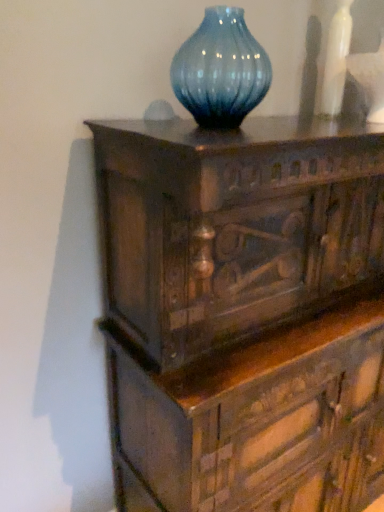
What do you see at coordinates (244, 310) in the screenshot? This screenshot has width=384, height=512. I see `dark wood chest of drawers at center` at bounding box center [244, 310].

What is the approximate width of dark wood chest of drawers at center?

The width of dark wood chest of drawers at center is 21.06 inches.

At what (x,y) coordinates should I click in order to perform the action: click on dark wood chest of drawers at center. Please return your answer as a coordinate pair (x, y). The width and height of the screenshot is (384, 512). Looking at the image, I should click on (244, 310).

In order to face dark wood chest of drawers at center, should I rotate leftwards or rightwards?

Rotate right and turn 16.116 degrees.

Image resolution: width=384 pixels, height=512 pixels. What do you see at coordinates (336, 59) in the screenshot? I see `white glossy vase at upper right` at bounding box center [336, 59].

Measure the distance between point (344, 31) and camera.

Point (344, 31) and camera are 3.94 feet apart from each other.

Locate an element on the screen. Image resolution: width=384 pixels, height=512 pixels. white glossy vase at upper right is located at coordinates (336, 59).

Identify the location of dark wood chest of drawers at center. The width and height of the screenshot is (384, 512). (244, 310).

Which object is positioned more to the right, white glossy vase at upper right or dark wood chest of drawers at center?

Positioned to the right is dark wood chest of drawers at center.

Which object is further away from the camera, white glossy vase at upper right or dark wood chest of drawers at center?

white glossy vase at upper right is further from the camera.

Is point (339, 91) more distant than point (223, 349)?

Yes.

From the image's perspective, is white glossy vase at upper right beneath dark wood chest of drawers at center?

No, from the image's perspective, white glossy vase at upper right is not beneath dark wood chest of drawers at center.

From a real-world perspective, is white glossy vase at upper right on dark wood chest of drawers at center?

Yes, from a real-world perspective, white glossy vase at upper right is over dark wood chest of drawers at center

Is white glossy vase at upper right thinner than dark wood chest of drawers at center?

Correct, the width of white glossy vase at upper right is less than that of dark wood chest of drawers at center.

Is white glossy vase at upper right taller than dark wood chest of drawers at center?

In fact, white glossy vase at upper right may be shorter than dark wood chest of drawers at center.

Looking at the image, does white glossy vase at upper right seem bigger or smaller compared to dark wood chest of drawers at center?

white glossy vase at upper right is smaller than dark wood chest of drawers at center.

Is white glossy vase at upper right situated inside dark wood chest of drawers at center or outside?

The correct answer is: outside.

Is white glossy vase at upper right next to dark wood chest of drawers at center and touching it?

white glossy vase at upper right and dark wood chest of drawers at center are not in contact.

In the scene shown: Is white glossy vase at upper right positioned with its back to dark wood chest of drawers at center?

No.

What's the angular difference between white glossy vase at upper right and dark wood chest of drawers at center's facing directions?

white glossy vase at upper right and dark wood chest of drawers at center are facing 0.00284 degrees away from each other.

Find the location of `vase above the dark wood chest of drawers at center (from a real-world perspective)`. vase above the dark wood chest of drawers at center (from a real-world perspective) is located at coordinates (336, 59).

Considering the positions of objects dark wood chest of drawers at center and white glossy vase at upper right in the image provided, who is more to the right, dark wood chest of drawers at center or white glossy vase at upper right?

dark wood chest of drawers at center.

Considering the relative positions of dark wood chest of drawers at center and white glossy vase at upper right in the image provided, is dark wood chest of drawers at center behind white glossy vase at upper right?

No, the depth of dark wood chest of drawers at center is less than that of white glossy vase at upper right.

Is point (344, 421) more distant than point (344, 5)?

Yes, it is behind point (344, 5).

From the image's perspective, is dark wood chest of drawers at center below white glossy vase at upper right?

Correct, dark wood chest of drawers at center appears lower than white glossy vase at upper right in the image.

From a real-world perspective, between dark wood chest of drawers at center and white glossy vase at upper right, who is vertically lower?

dark wood chest of drawers at center is physically lower.

Between dark wood chest of drawers at center and white glossy vase at upper right, which one has smaller width?

white glossy vase at upper right is thinner.

Is dark wood chest of drawers at center shorter than white glossy vase at upper right?

In fact, dark wood chest of drawers at center may be taller than white glossy vase at upper right.

Which of these two, dark wood chest of drawers at center or white glossy vase at upper right, is smaller?

Smaller between the two is white glossy vase at upper right.

Does dark wood chest of drawers at center contain white glossy vase at upper right?

No, white glossy vase at upper right is not surrounded by dark wood chest of drawers at center.

Is dark wood chest of drawers at center far from white glossy vase at upper right?

Actually, dark wood chest of drawers at center and white glossy vase at upper right are a little close together.

Is dark wood chest of drawers at center oriented away from white glossy vase at upper right?

dark wood chest of drawers at center is not turned away from white glossy vase at upper right.

What's the angular difference between dark wood chest of drawers at center and white glossy vase at upper right's facing directions?

The facing directions of dark wood chest of drawers at center and white glossy vase at upper right are 0.00284 degrees apart.

From the picture: Measure the distance between dark wood chest of drawers at center and white glossy vase at upper right.

dark wood chest of drawers at center is 27.62 inches away from white glossy vase at upper right.

Identify the location of chest of drawers below the white glossy vase at upper right (from the image's perspective). This screenshot has height=512, width=384. (244, 310).

What are the coordinates of `chest of drawers below the white glossy vase at upper right (from a real-world perspective)` in the screenshot? It's located at (244, 310).

In order to click on the chest of drawers lying below the white glossy vase at upper right (from the image's perspective) in this screenshot , I will do `click(244, 310)`.